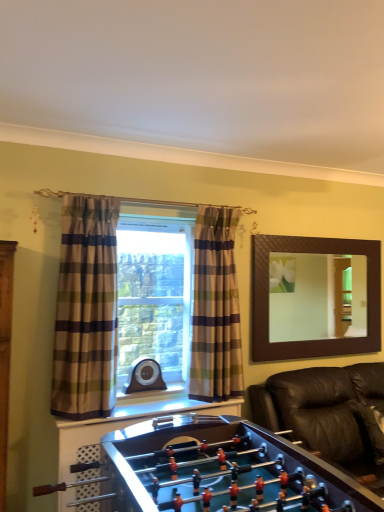
The image size is (384, 512). I want to click on empty space that is ontop of brown textured mirror at upper right, so click(306, 237).